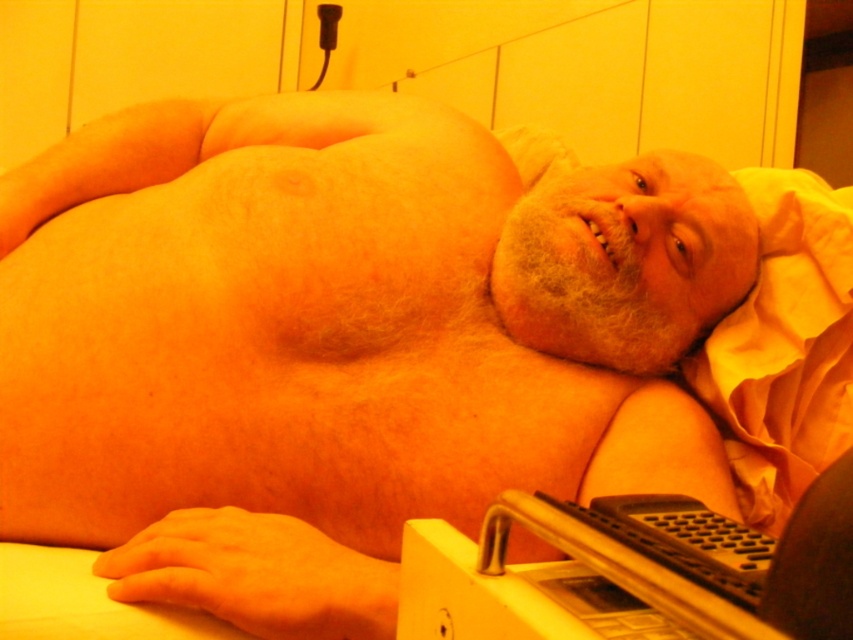
Question: Among these objects, which one is nearest to the camera?

Choices:
 (A) black plastic laptop at lower right
 (B) yellow fabric pillow at right

Answer: (A)

Question: Which point is farther to the camera?

Choices:
 (A) black plastic laptop at lower right
 (B) yellow fabric pillow at right

Answer: (B)

Question: Can you confirm if black plastic laptop at lower right is thinner than yellow fabric pillow at right?

Choices:
 (A) yes
 (B) no

Answer: (A)

Question: Can you confirm if black plastic laptop at lower right is thinner than yellow fabric pillow at right?

Choices:
 (A) yes
 (B) no

Answer: (A)

Question: Is black plastic laptop at lower right above yellow fabric pillow at right?

Choices:
 (A) yes
 (B) no

Answer: (B)

Question: Which of the following is the farthest from the observer?

Choices:
 (A) (795, 372)
 (B) (625, 609)

Answer: (A)